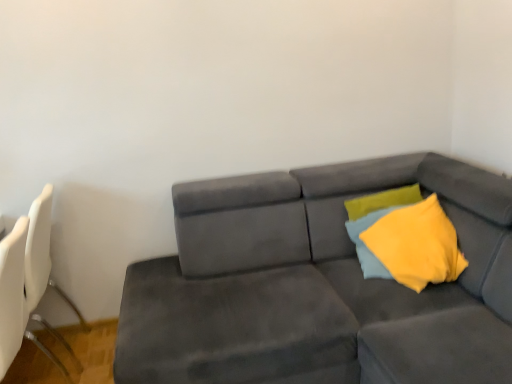
Question: Is point (239, 329) closer or farther from the camera than point (46, 215)?

Choices:
 (A) farther
 (B) closer

Answer: (B)

Question: In terms of width, does suede gray couch at center look wider or thinner when compared to white plastic swivel chair at left?

Choices:
 (A) wide
 (B) thin

Answer: (A)

Question: Considering the real-world distances, which object is farthest from the yellow fabric pillow at upper right?

Choices:
 (A) soft yellow fabric pillow at right
 (B) suede gray couch at center
 (C) white plastic swivel chair at left

Answer: (C)

Question: Which object is positioned farthest from the white plastic swivel chair at left?

Choices:
 (A) soft yellow fabric pillow at right
 (B) yellow fabric pillow at upper right
 (C) suede gray couch at center

Answer: (B)